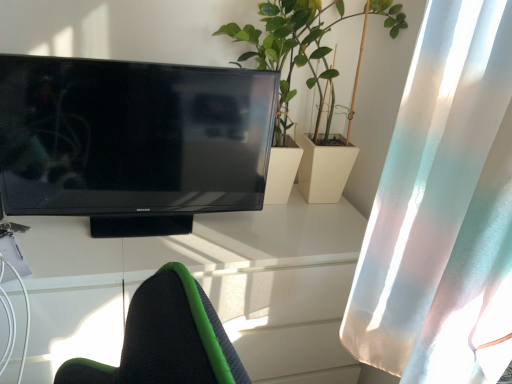
At what (x,y) coordinates should I click in order to perform the action: click on vacant region to the right of matte black television at left. Please return your answer as a coordinate pair (x, y). Image resolution: width=512 pixels, height=384 pixels. Looking at the image, I should click on (271, 232).